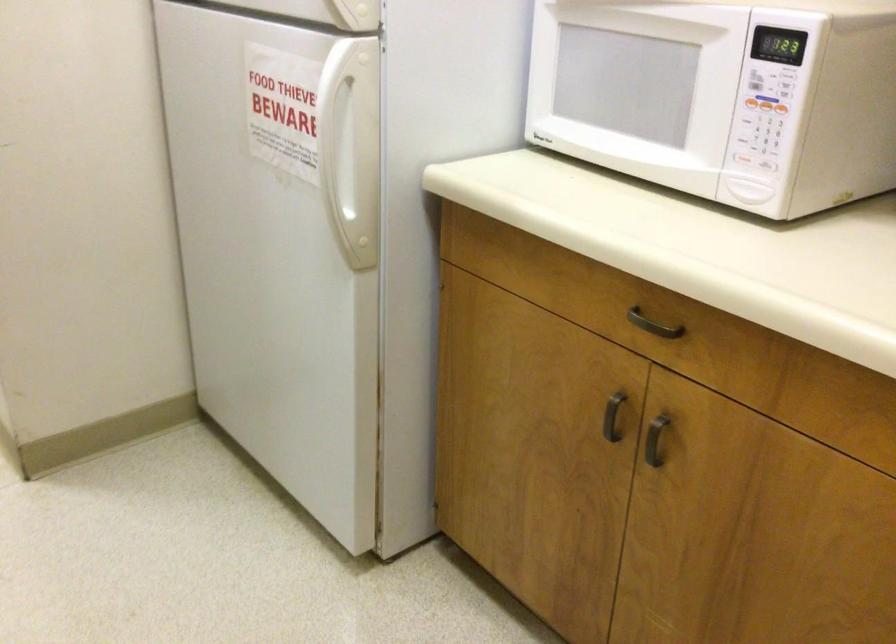
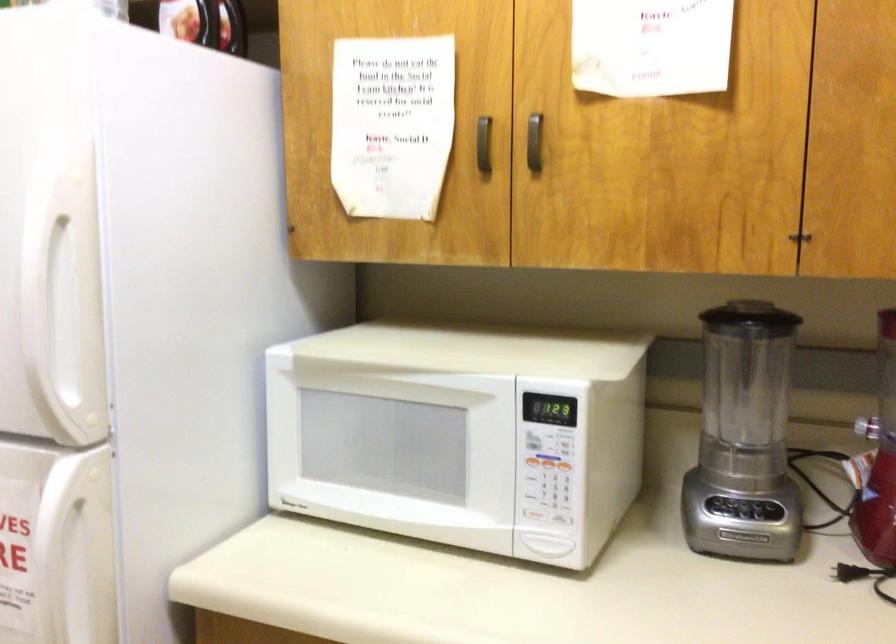
The point at (x=738, y=154) is marked in the first image. Where is the corresponding point in the second image?

(533, 515)